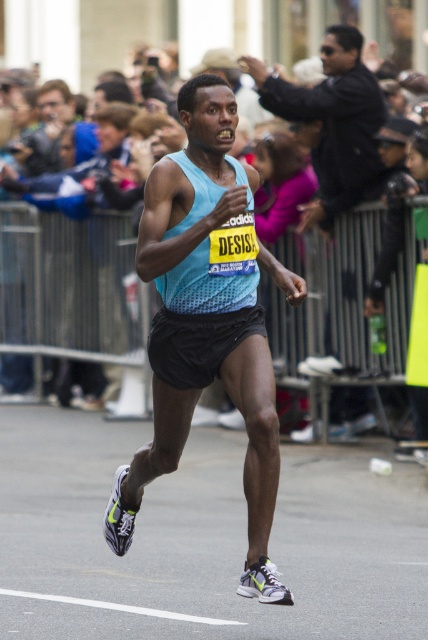
You are a photographer positioned at the starting line of the marathon. You want to capture a closeup shot of the central runner wearing a light blue tank top with the Adidas logo. However, your camera has a maximum zoom range of 10 meters. Is the point at coordinates point (148, 269) within your camera range to take the photo?

The distance between point (148, 269) and the viewer is 7.92 meters, which is within the camera maximum zoom range of 10 meters. Therefore, the photographer can capture the closeup shot.

You are a photographer standing behind the dark gray metal fence at center, trying to take a photo of the runner wearing the light blue fabric tank top at center. Can you fit the entire tank top into your camera frame without moving your position?

The light blue fabric tank top at center has a larger width than the dark gray metal fence at center. Since the fence is between you and the runner, the tank top would extend beyond the fence, making it impossible to capture the entire tank top in the frame without moving.